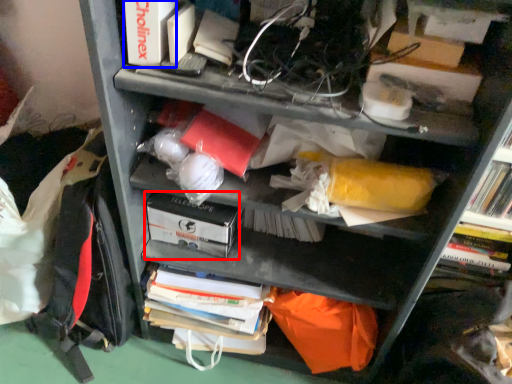
Question: Among these objects, which one is farthest to the camera, paperback book (highlighted by a red box) or paperback book (highlighted by a blue box)?

Choices:
 (A) paperback book
 (B) paperback book

Answer: (A)